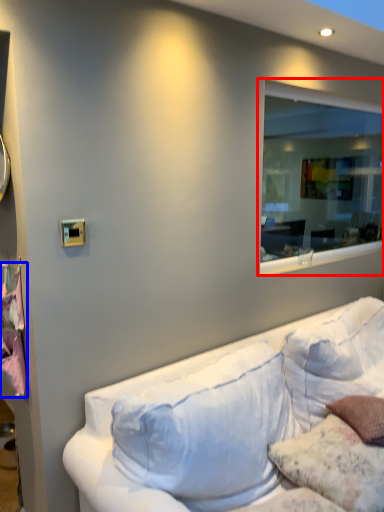
Question: Which of the following is the farthest to the observer, window (highlighted by a red box) or sheet (highlighted by a blue box)?

Choices:
 (A) window
 (B) sheet

Answer: (A)